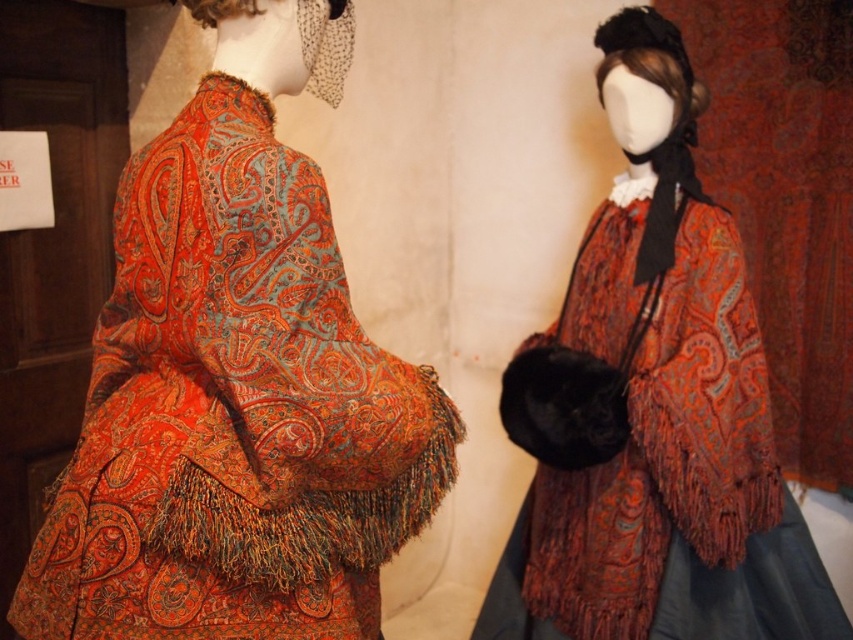
You are standing in front of the two mannequins. You notice two points marked on the image. The first point is at coordinates point (222,316) and the second point is at point (732,250). Which point is closer to you?

Point (222,316) is closer to the viewer than point (732,250).